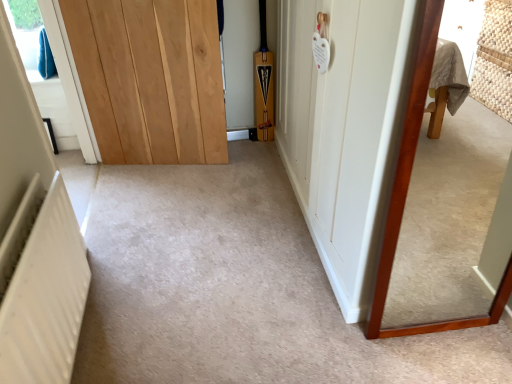
Question: Which direction should I rotate to look at white wood door at center, which is the second door from left to right?

Choices:
 (A) left
 (B) right

Answer: (B)

Question: Does white textured radiator at lower left have a smaller size compared to white wood door at center, which is the second door from left to right?

Choices:
 (A) yes
 (B) no

Answer: (A)

Question: Is white textured radiator at lower left facing away from white wood door at center, which is the second door from left to right?

Choices:
 (A) yes
 (B) no

Answer: (B)

Question: Is white wood door at center, which is the second door from left to right, inside white textured radiator at lower left?

Choices:
 (A) yes
 (B) no

Answer: (B)

Question: From the image's perspective, is white textured radiator at lower left beneath white wood door at center, which is the second door from left to right?

Choices:
 (A) yes
 (B) no

Answer: (A)

Question: Are white textured radiator at lower left and white wood door at center, the first door from the right, beside each other?

Choices:
 (A) yes
 (B) no

Answer: (B)

Question: From a real-world perspective, is white textured radiator at lower left physically below white wood door at center, which is the second door from left to right?

Choices:
 (A) yes
 (B) no

Answer: (A)

Question: Is white wood door at center, the first door from the right, not close to light brown wood door at center, the 1th door from the left?

Choices:
 (A) no
 (B) yes

Answer: (A)

Question: From the image's perspective, is white wood door at center, the first door from the right, on light brown wood door at center, the 1th door from the left?

Choices:
 (A) yes
 (B) no

Answer: (B)

Question: Can you see white wood door at center, which is the second door from left to right, touching light brown wood door at center, the 2th door from the right?

Choices:
 (A) yes
 (B) no

Answer: (B)

Question: Is the position of white wood door at center, the first door from the right, more distant than that of light brown wood door at center, the 1th door from the left?

Choices:
 (A) no
 (B) yes

Answer: (A)

Question: From a real-world perspective, is white wood door at center, the first door from the right, below light brown wood door at center, the 1th door from the left?

Choices:
 (A) no
 (B) yes

Answer: (A)

Question: Could you tell me if white wood door at center, the first door from the right, is turned towards light brown wood door at center, the 1th door from the left?

Choices:
 (A) no
 (B) yes

Answer: (B)

Question: Is white textured radiator at lower left oriented away from wooden-framed mirror at right?

Choices:
 (A) yes
 (B) no

Answer: (B)